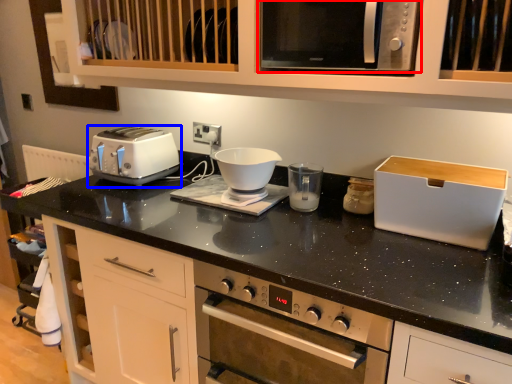
Question: Among these objects, which one is farthest to the camera, microwave oven (highlighted by a red box) or toaster (highlighted by a blue box)?

Choices:
 (A) microwave oven
 (B) toaster

Answer: (B)